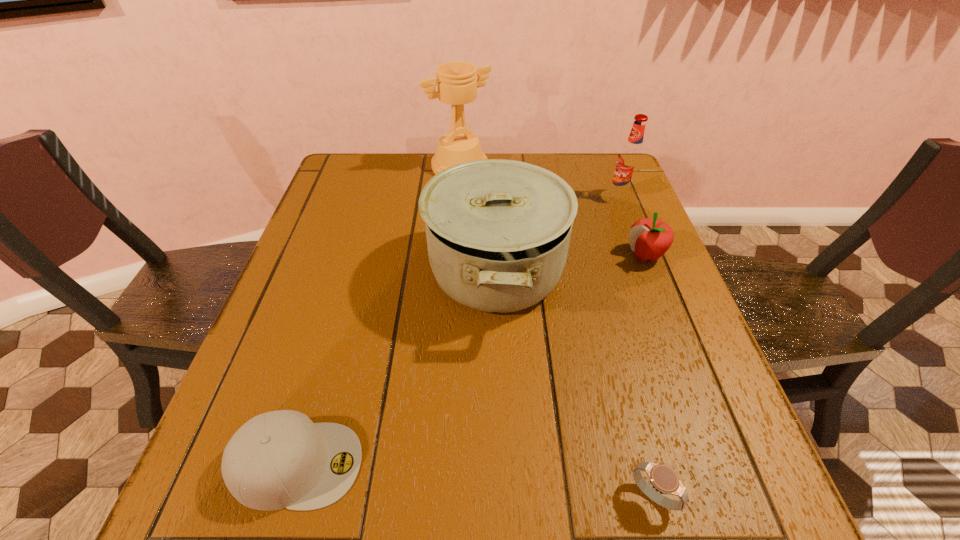
Choose which object is the third nearest neighbor to the apple. Please provide its 2D coordinates. Your answer should be formatted as a tuple, i.e. [(x, y)], where the tuple contains the x and y coordinates of a point satisfying the conditions above.

[(457, 84)]

At what (x,y) coordinates should I click in order to perform the action: click on vacant space that satisfies the following two spatial constraints: 1. on the back side of the root beer; 2. on the left side of the watch. Please return your answer as a coordinate pair (x, y). Looking at the image, I should click on (574, 197).

Where is `vacant space that satisfies the following two spatial constraints: 1. on the front side of the shortest object; 2. on the right side of the award`? The width and height of the screenshot is (960, 540). vacant space that satisfies the following two spatial constraints: 1. on the front side of the shortest object; 2. on the right side of the award is located at coordinates (440, 496).

Find the location of a particular element. The width and height of the screenshot is (960, 540). free location that satisfies the following two spatial constraints: 1. on the front side of the root beer; 2. on the left side of the award is located at coordinates (458, 197).

At what (x,y) coordinates should I click in order to perform the action: click on vacant point that satisfies the following two spatial constraints: 1. on the back side of the apple; 2. on the left side of the saucepan. Please return your answer as a coordinate pair (x, y). The image size is (960, 540). Looking at the image, I should click on pos(495,255).

Locate an element on the screen. This screenshot has width=960, height=540. blank area in the image that satisfies the following two spatial constraints: 1. on the back side of the apple; 2. on the left side of the saucepan is located at coordinates (495, 255).

You are a GUI agent. You are given a task and a screenshot of the screen. Output one action in this format:
    pyautogui.click(x=<x>, y=<y>)
    Task: Click on the free spot that satisfies the following two spatial constraints: 1. on the front side of the farthest object; 2. on the left side of the fifth nearest object
    This screenshot has height=540, width=960.
    Given the screenshot: What is the action you would take?
    pyautogui.click(x=458, y=197)